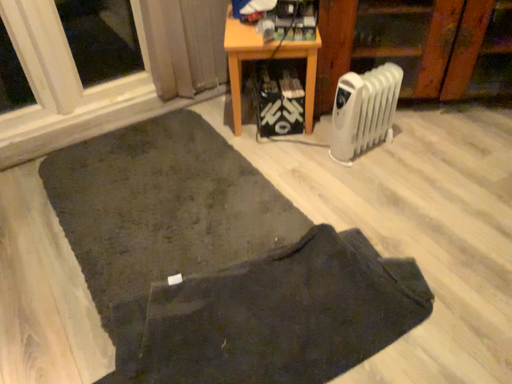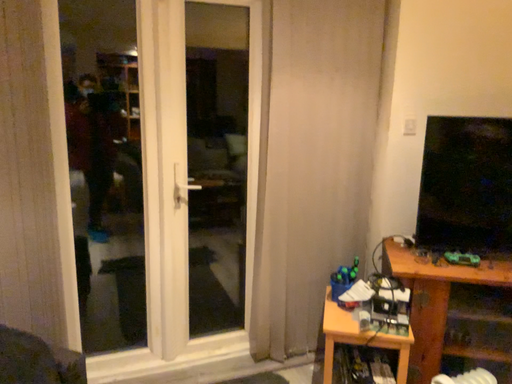
Question: Which way did the camera rotate in the video?

Choices:
 (A) rotated right
 (B) rotated left

Answer: (B)